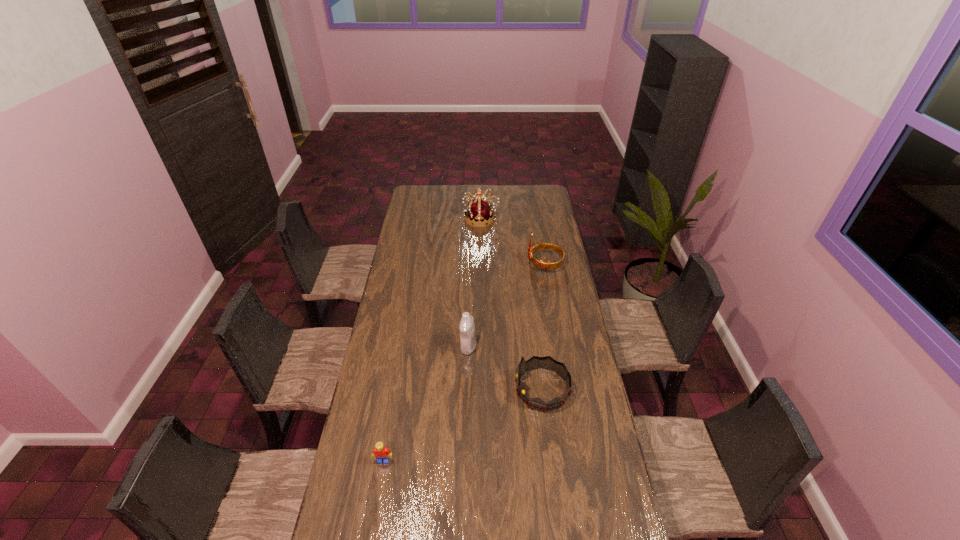
At what (x,y) coordinates should I click in order to perform the action: click on object that is the closest to the Lego. Please return your answer as a coordinate pair (x, y). The height and width of the screenshot is (540, 960). Looking at the image, I should click on (547, 362).

This screenshot has height=540, width=960. Identify the location of the third closest object relative to the second farthest tiara. (547, 362).

Find the location of a particular element. The height and width of the screenshot is (540, 960). tiara that is the nearest to the second farthest object is located at coordinates (479, 212).

The width and height of the screenshot is (960, 540). Find the location of `tiara that stands as the second closest to the detergent`. tiara that stands as the second closest to the detergent is located at coordinates (541, 264).

I want to click on free space in the image that satisfies the following two spatial constraints: 1. on the front-facing side of the second nearest tiara; 2. on the face of the shortest object, so 579,461.

Image resolution: width=960 pixels, height=540 pixels. Identify the location of free location that satisfies the following two spatial constraints: 1. on the front-facing side of the farthest tiara; 2. on the face of the leftmost object. (482, 461).